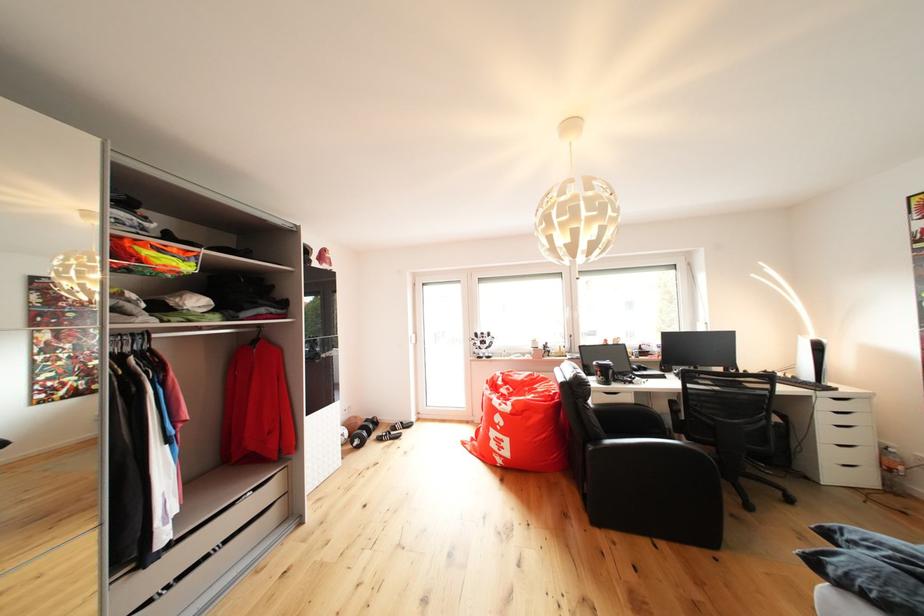
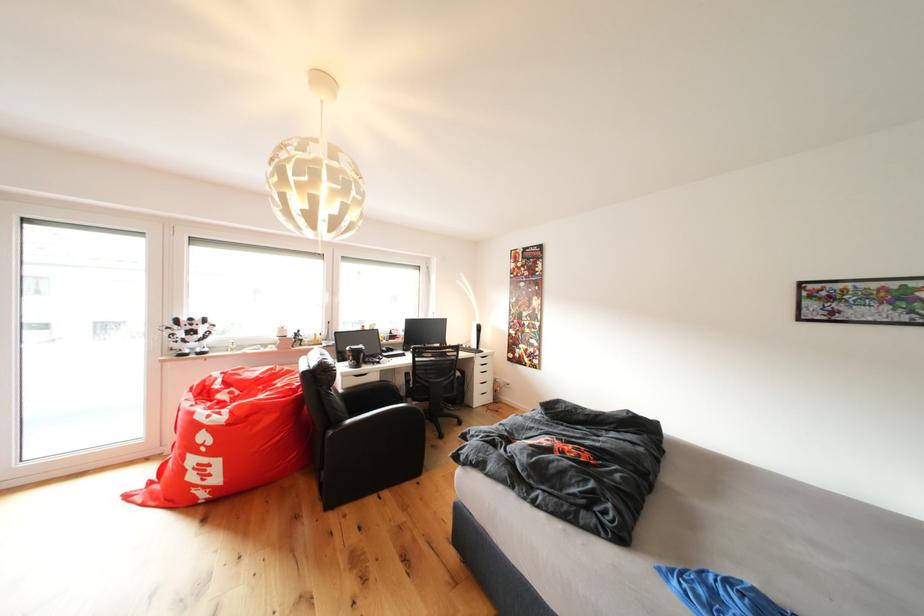
Question: Based on the continuous images, in which direction is the camera rotating? Reply with the corresponding letter.

Choices:
 (A) Left
 (B) Right
 (C) Up
 (D) Down

Answer: (B)